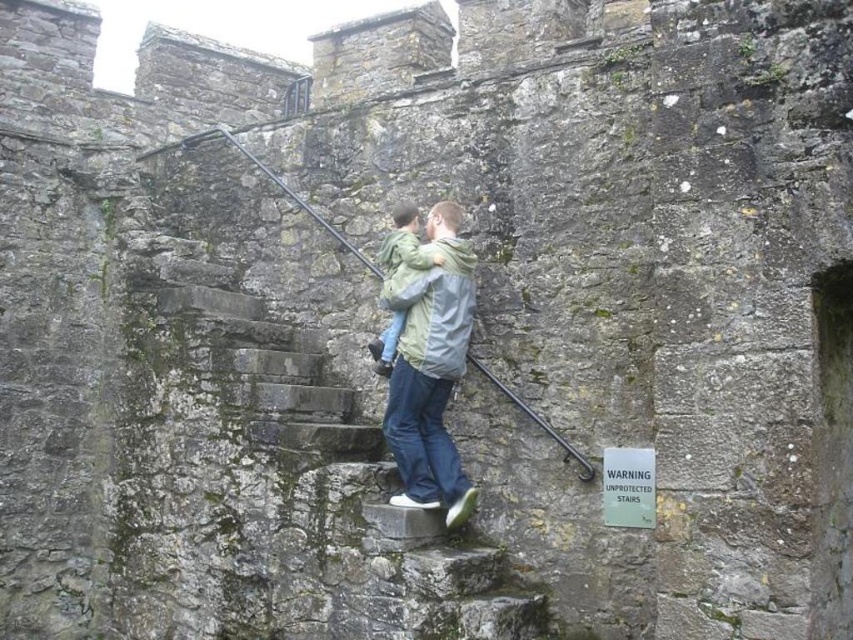
Can you confirm if gray stone stairs at center is thinner than light green fabric boy at center?

No, gray stone stairs at center is not thinner than light green fabric boy at center.

Is point (305, 468) closer to viewer compared to point (410, 385)?

That is False.

Describe the element at coordinates (335, 496) in the screenshot. The width and height of the screenshot is (853, 640). I see `gray stone stairs at center` at that location.

Locate an element on the screen. The image size is (853, 640). gray stone stairs at center is located at coordinates (335, 496).

How much distance is there between gray stone stairs at center and light green fabric at center?

A distance of 6.69 meters exists between gray stone stairs at center and light green fabric at center.

Looking at this image, who is higher up, gray stone stairs at center or light green fabric at center?

light green fabric at center

Describe the element at coordinates (335, 496) in the screenshot. I see `gray stone stairs at center` at that location.

This screenshot has height=640, width=853. Find the location of `gray stone stairs at center`. gray stone stairs at center is located at coordinates (335, 496).

Is point (457, 376) positioned after point (396, 320)?

No, (457, 376) is in front of (396, 320).

Is point (428, 474) more distant than point (422, 248)?

No.

Image resolution: width=853 pixels, height=640 pixels. In order to click on light green fabric boy at center in this screenshot , I will do `click(430, 365)`.